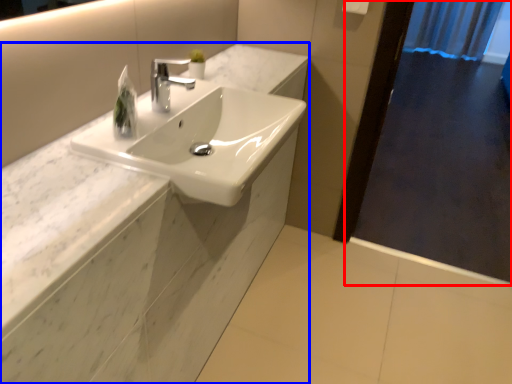
Question: Among these objects, which one is farthest to the camera, screen door (highlighted by a red box) or counter (highlighted by a blue box)?

Choices:
 (A) screen door
 (B) counter

Answer: (A)